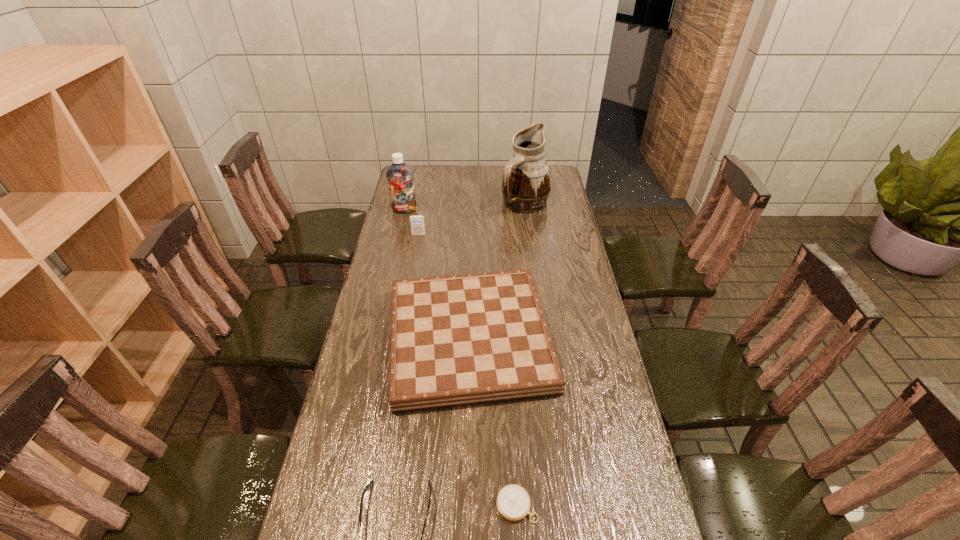
Where is `free region located on the back of the gameboard`? free region located on the back of the gameboard is located at coordinates (471, 260).

Where is `vacant space located 0.260m on the back of the compass`? This screenshot has height=540, width=960. vacant space located 0.260m on the back of the compass is located at coordinates (511, 397).

At what (x,y) coordinates should I click in order to perform the action: click on object located at the far edge. Please return your answer as a coordinate pair (x, y). Image resolution: width=960 pixels, height=540 pixels. Looking at the image, I should click on (526, 186).

The height and width of the screenshot is (540, 960). I want to click on shampoo present at the left edge, so click(399, 175).

This screenshot has height=540, width=960. In order to click on iPod that is positioned at the left edge in this screenshot , I will do `click(417, 221)`.

Image resolution: width=960 pixels, height=540 pixels. I want to click on gameboard that is at the left edge, so click(459, 340).

The height and width of the screenshot is (540, 960). I want to click on pitcher located in the right edge section of the desktop, so click(x=526, y=186).

Find the location of a particular element. gameboard that is positioned at the right edge is located at coordinates pyautogui.click(x=459, y=340).

Locate an element on the screen. The image size is (960, 540). object situated at the far right corner is located at coordinates (526, 186).

Where is `blank space at the left edge of the desktop`? The height and width of the screenshot is (540, 960). blank space at the left edge of the desktop is located at coordinates (369, 318).